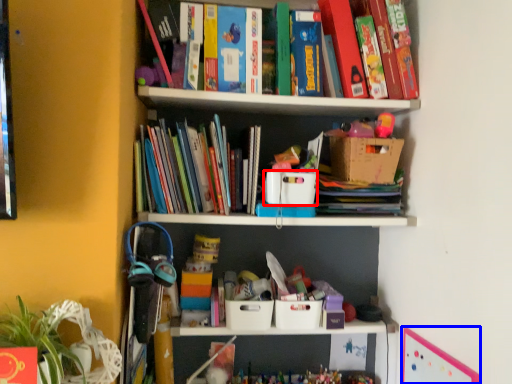
Question: Which object appears closest to the camera in this image, storage box (highlighted by a red box) or bulletin board (highlighted by a blue box)?

Choices:
 (A) storage box
 (B) bulletin board

Answer: (B)